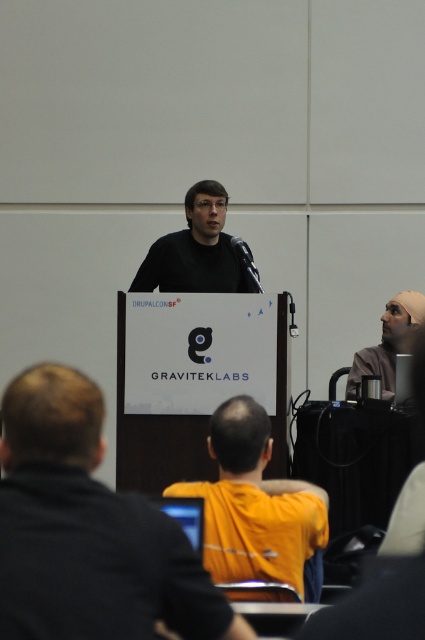
Question: Which of the following is the farthest from the observer?

Choices:
 (A) pyautogui.click(x=416, y=296)
 (B) pyautogui.click(x=238, y=276)

Answer: (A)

Question: Can you confirm if yellow fabric shirt at center is positioned below matte black shirt at center?

Choices:
 (A) no
 (B) yes

Answer: (B)

Question: Which point is closer to the camera taking this photo?

Choices:
 (A) (226, 417)
 (B) (116, 634)
 (C) (353, 360)

Answer: (B)

Question: Can you confirm if matte black shirt at center is thinner than matte black beanie at upper right?

Choices:
 (A) yes
 (B) no

Answer: (B)

Question: Does matte black shirt at center have a larger size compared to matte black beanie at upper right?

Choices:
 (A) yes
 (B) no

Answer: (B)

Question: Among these points, which one is nearest to the camera?

Choices:
 (A) click(x=198, y=563)
 (B) click(x=159, y=257)

Answer: (A)